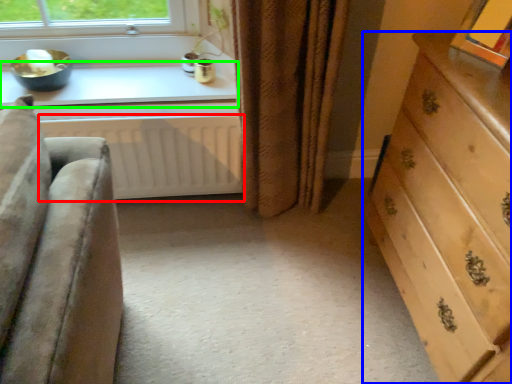
Question: Estimate the real-world distances between objects in this image. Which object is closer to radiator (highlighted by a red box), chest of drawers (highlighted by a blue box) or window sill (highlighted by a green box)?

Choices:
 (A) chest of drawers
 (B) window sill

Answer: (B)